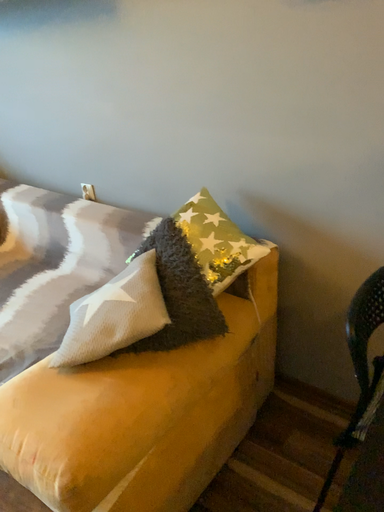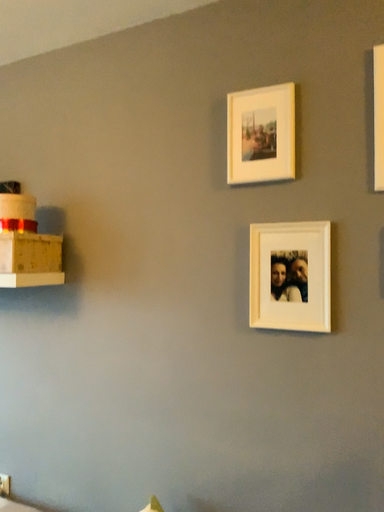
Question: How did the camera likely rotate when shooting the video?

Choices:
 (A) rotated downward
 (B) rotated upward

Answer: (B)